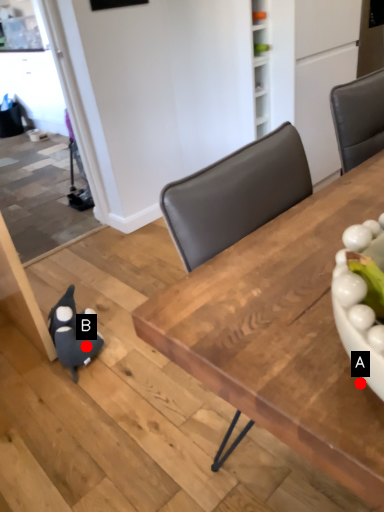
Question: Two points are circled on the image, labeled by A and B beside each circle. Which point is closer to the camera taking this photo?

Choices:
 (A) A is closer
 (B) B is closer

Answer: (A)